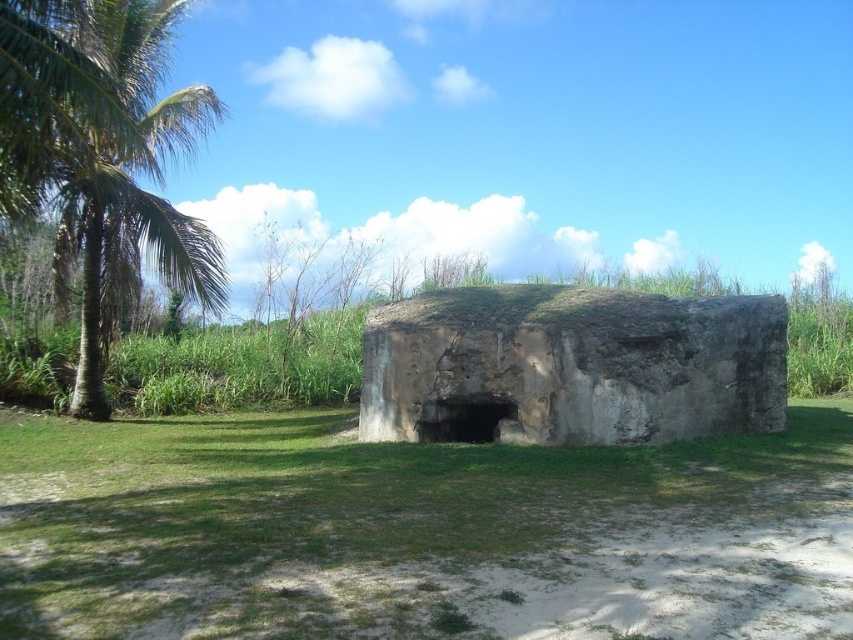
You are standing at the entrance of the bunker and want to move towards the point at coordinates point (434, 291) and point (44, 16). Which point will require you to walk further away from the bunker to reach?

Point (44, 16) will require you to walk further away from the bunker because it is closer to the viewer, meaning it is physically nearer to your current position at the entrance. Since you need to move towards it, you would have to step forward away from the bunker to reach it.

You are a hiker who wants to take shelter from the rain. You see the gray stone bunker at center and the green leafy palm at left. Which one can provide better protection from the rain?

The gray stone bunker at center is positioned under green leafy palm at left, so the bunker is located beneath the palm tree. However, the palm tree itself may not provide direct shelter over the bunker. Since the bunker has a dark opening at the front, it is likely the better option for shelter from the rain as it offers a covered structure.

You are planning to place a small garden between the gray stone bunker at center and the green leafy palm at left. Which object should you position closer to the garden to ensure it fits within the available space?

The green leafy palm at left should be positioned closer to the garden since the gray stone bunker at center is wider, leaving less space between them for the garden.